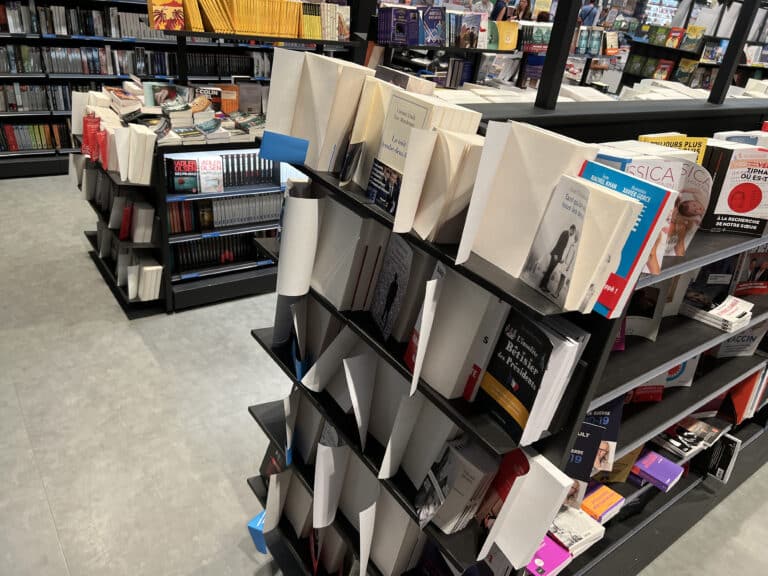
The image size is (768, 576). What are the coordinates of `black book sticking out of shelf` in the screenshot? It's located at (723, 467).